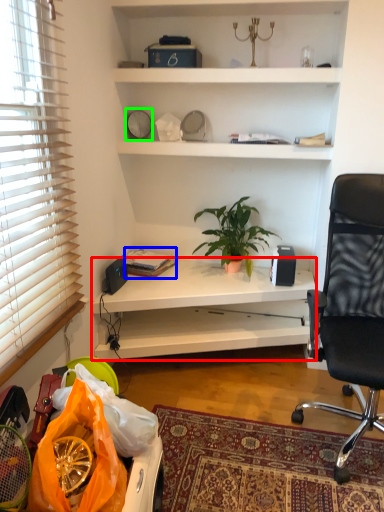
Question: Which object is positioned farthest from desk (highlighted by a red box)? Select from book (highlighted by a blue box) and clock (highlighted by a green box).

Choices:
 (A) book
 (B) clock

Answer: (B)